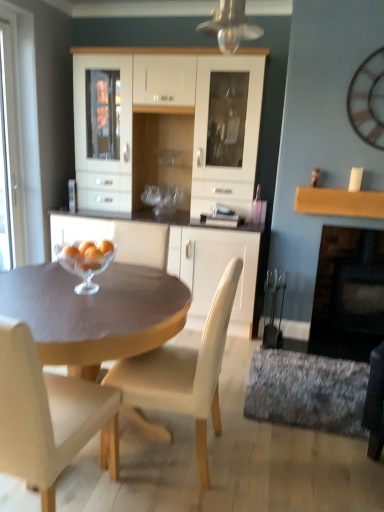
Find the location of a particular element. vacant area that lies to the right of clear glass bowl at center is located at coordinates (148, 287).